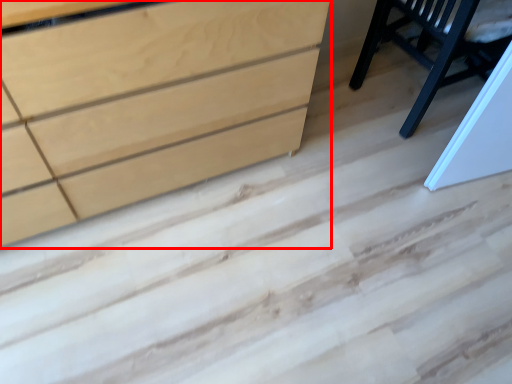
Question: In this image, where is chest of drawers (annotated by the red box) located relative to furniture?

Choices:
 (A) right
 (B) left

Answer: (B)